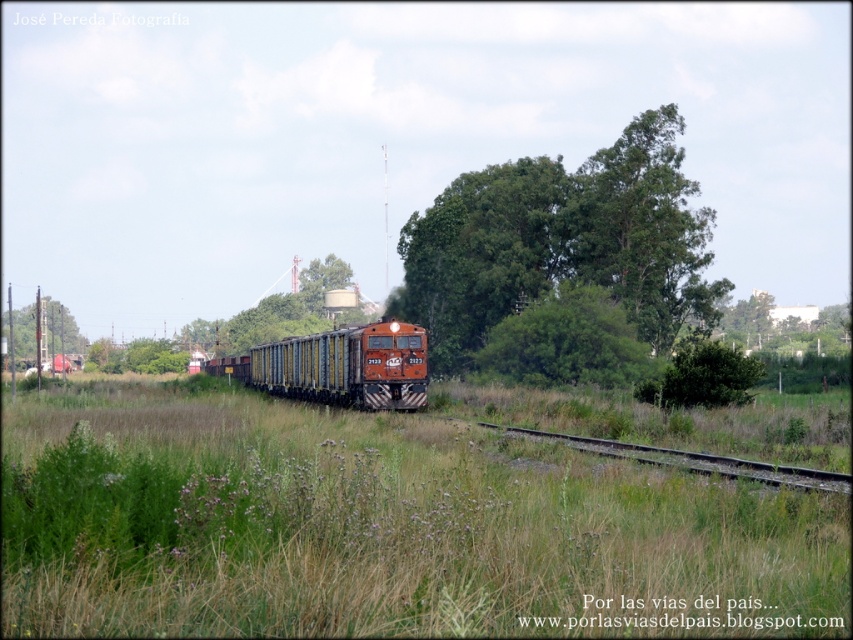
Question: Based on their relative distances, which object is nearer to the green leafy tree at center?

Choices:
 (A) green leafy tree at left
 (B) orange matte train at center
 (C) green grass at center

Answer: (B)

Question: Which of the following is the farthest from the observer?

Choices:
 (A) (45, 316)
 (B) (607, 273)
 (C) (398, 397)
 (D) (252, 621)

Answer: (A)

Question: Can you confirm if green grass at center is positioned below orange matte train at center?

Choices:
 (A) no
 (B) yes

Answer: (A)

Question: Is green grass at center wider than orange matte train at center?

Choices:
 (A) no
 (B) yes

Answer: (A)

Question: Is green leafy tree at center smaller than green leafy tree at left?

Choices:
 (A) yes
 (B) no

Answer: (A)

Question: Which object is closer to the camera taking this photo?

Choices:
 (A) orange matte train at center
 (B) green leafy tree at center

Answer: (A)